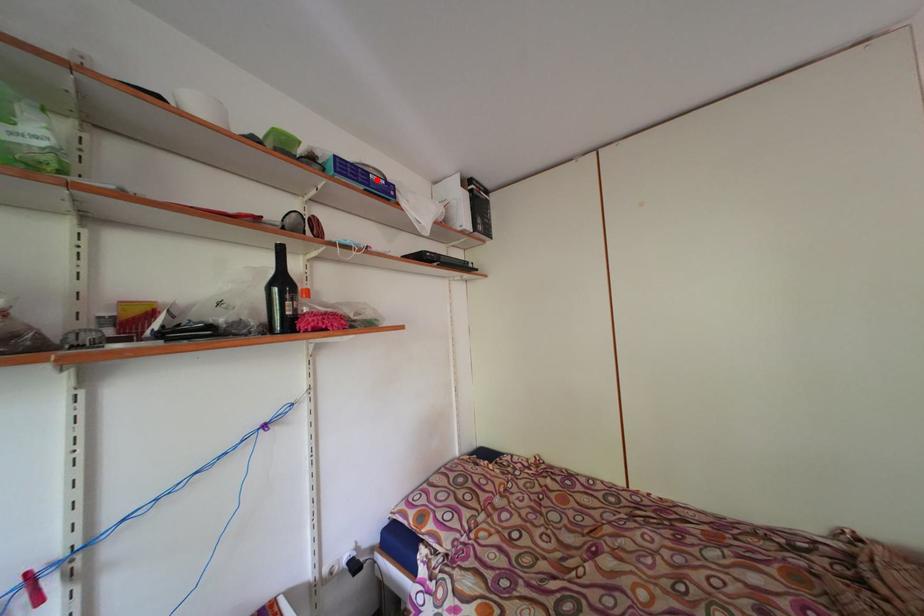
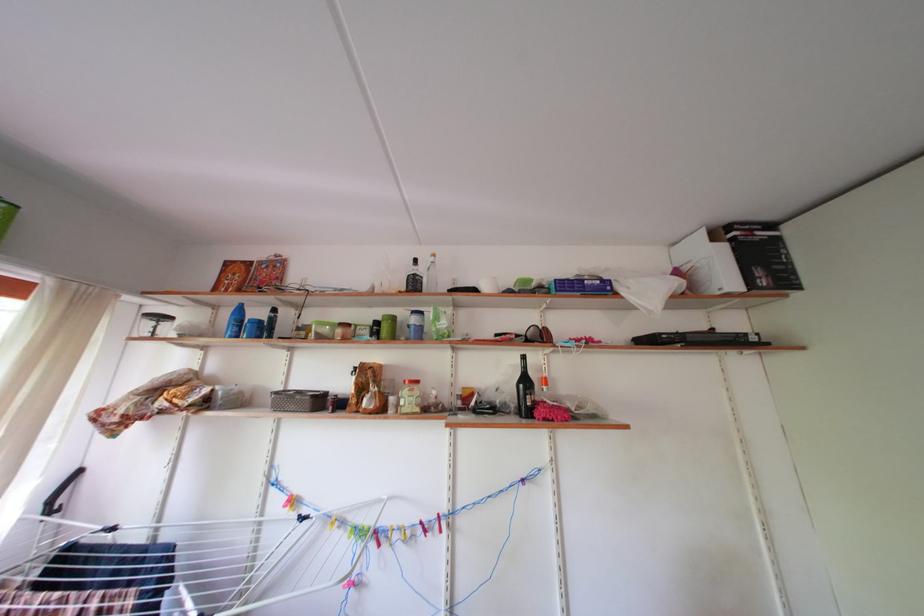
Locate, in the second image, the point that corresponds to the highlighted location in the first image.

(591, 286)